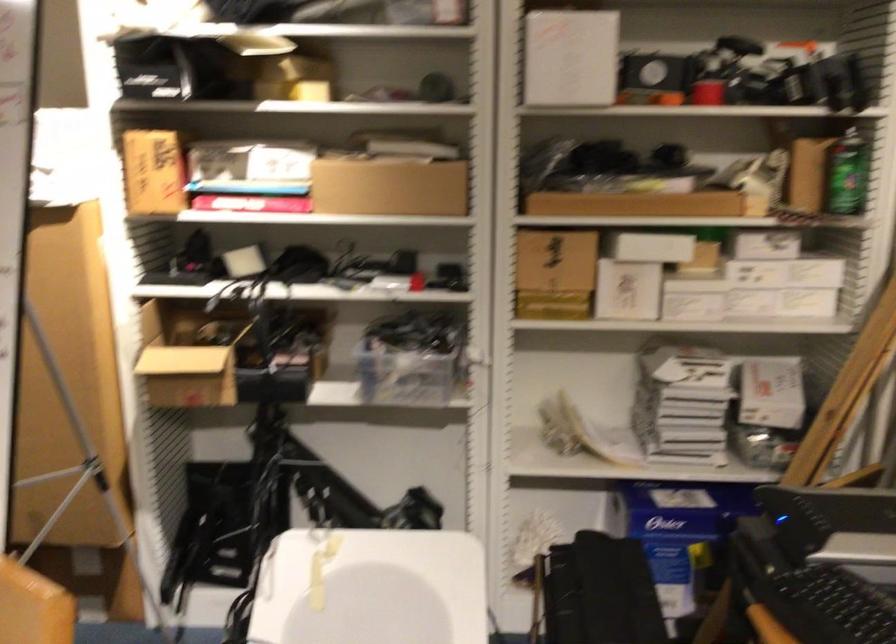
Which object does [403,375] point to?

It refers to a clear plastic container.